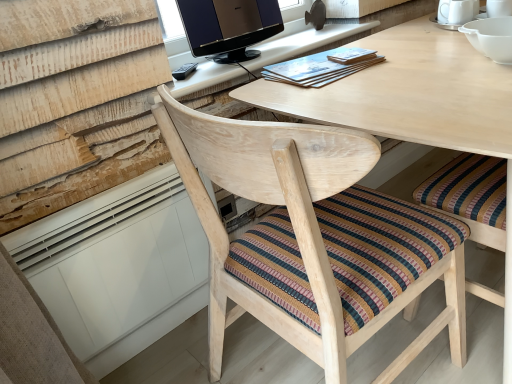
The height and width of the screenshot is (384, 512). In order to click on free location to the left of matte brown book at upper center, the first book positioned from the right in this screenshot , I will do `click(300, 68)`.